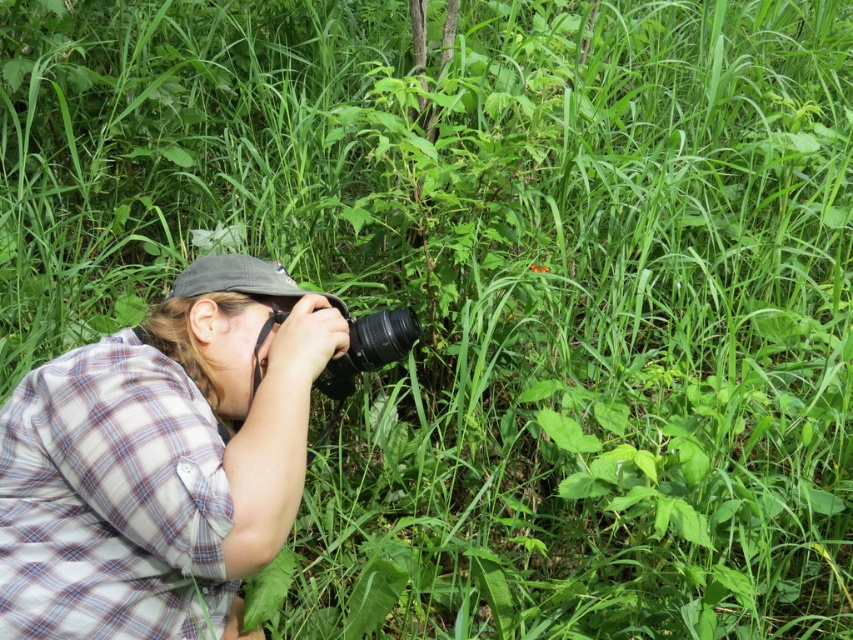
Can you confirm if plaid fabric shirt at left is positioned to the right of black plastic camera at center?

No, plaid fabric shirt at left is not to the right of black plastic camera at center.

Does plaid fabric shirt at left have a greater width compared to black plastic camera at center?

Indeed, plaid fabric shirt at left has a greater width compared to black plastic camera at center.

Where is `plaid fabric shirt at left`? This screenshot has width=853, height=640. plaid fabric shirt at left is located at coordinates (160, 460).

At what (x,y) coordinates should I click in order to perform the action: click on plaid fabric shirt at left. Please return your answer as a coordinate pair (x, y). Image resolution: width=853 pixels, height=640 pixels. Looking at the image, I should click on (160, 460).